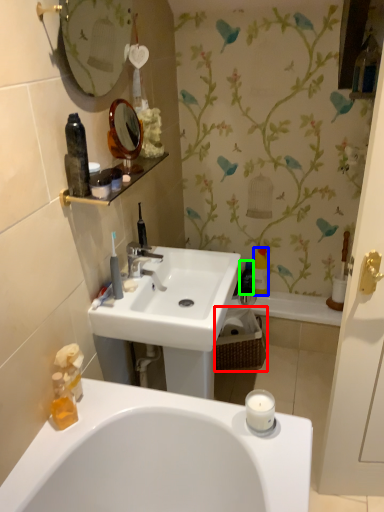
Question: Which object is positioned farthest from picnic basket (highlighted by a red box)? Select from bottle (highlighted by a blue box) and bottle (highlighted by a green box).

Choices:
 (A) bottle
 (B) bottle

Answer: (A)